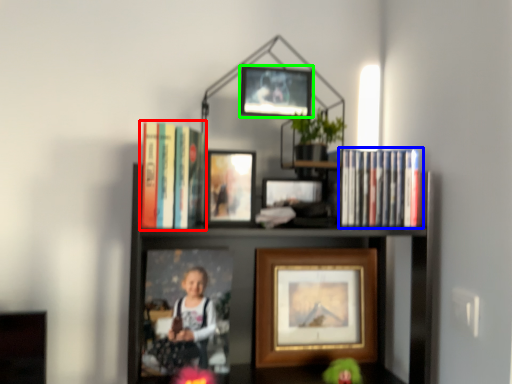
Question: Which object is the farthest from book (highlighted by a red box)? Choose among these: book (highlighted by a blue box) or picture frame (highlighted by a green box).

Choices:
 (A) book
 (B) picture frame

Answer: (A)